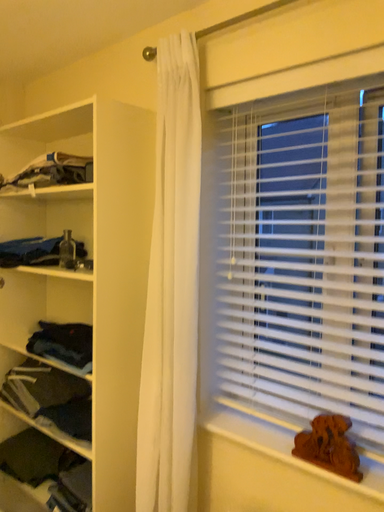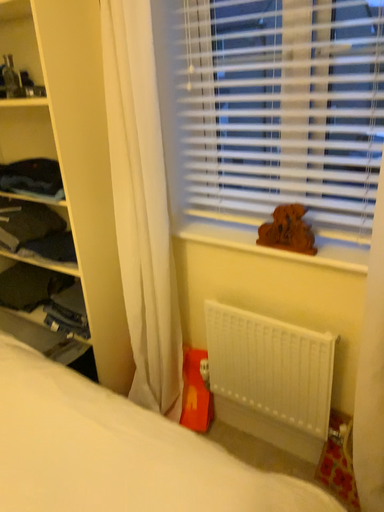
Question: How did the camera likely rotate when shooting the video?

Choices:
 (A) rotated left
 (B) rotated right

Answer: (B)